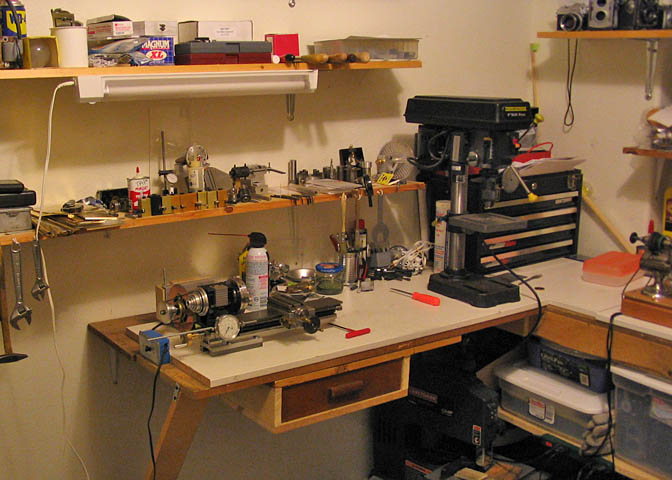
Where is `light that is off`? This screenshot has height=480, width=672. light that is off is located at coordinates (179, 91).